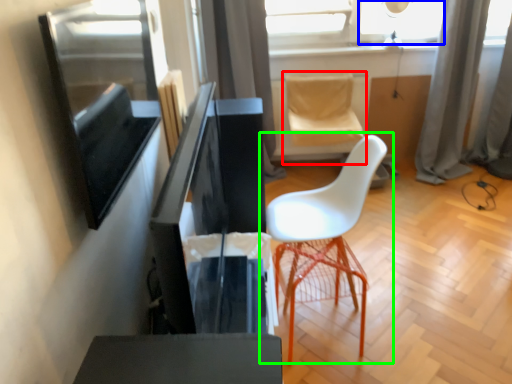
Question: Which object is the closest to the swivel chair (highlighted by a red box)? Choose among these: window (highlighted by a blue box) or chair (highlighted by a green box).

Choices:
 (A) window
 (B) chair

Answer: (A)